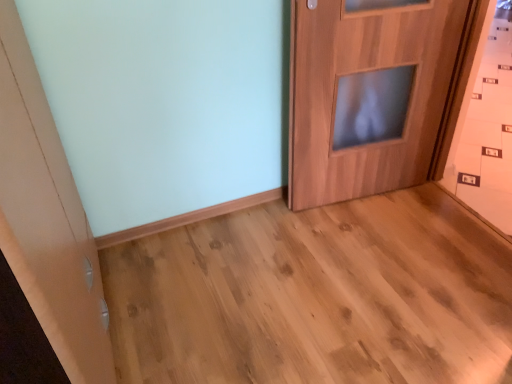
Identify the location of free space above natural wood floor at center (from a real-world perspective). click(x=326, y=274).